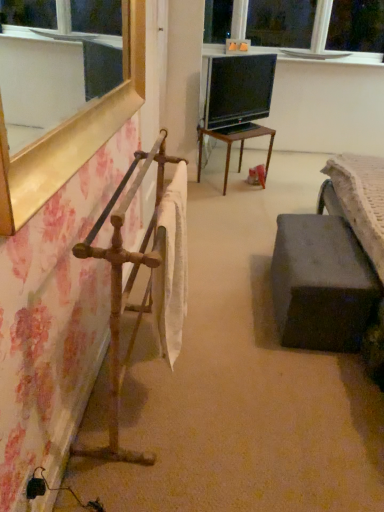
Identify the location of vacant space situated above matte gray ottoman at center (from a real-world perspective). (307, 246).